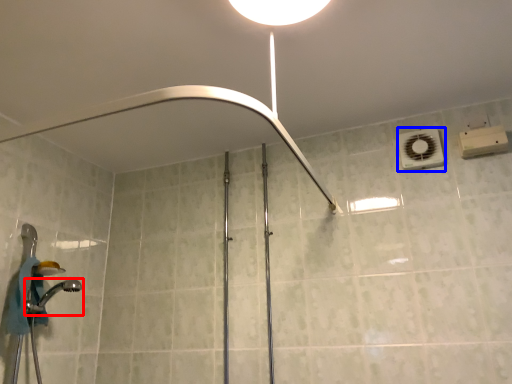
Question: Which object appears closest to the camera in this image, shower (highlighted by a red box) or air conditioner (highlighted by a blue box)?

Choices:
 (A) shower
 (B) air conditioner

Answer: (A)